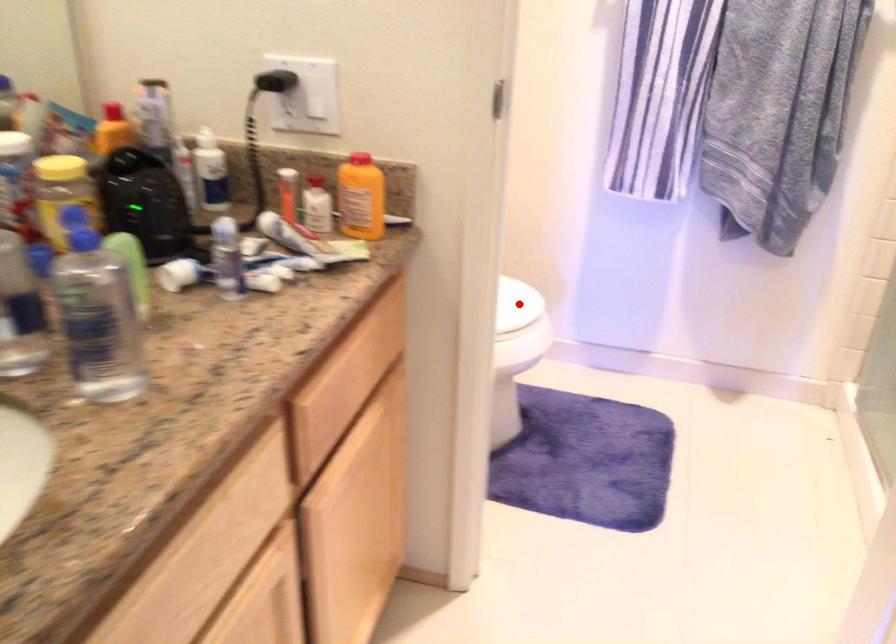
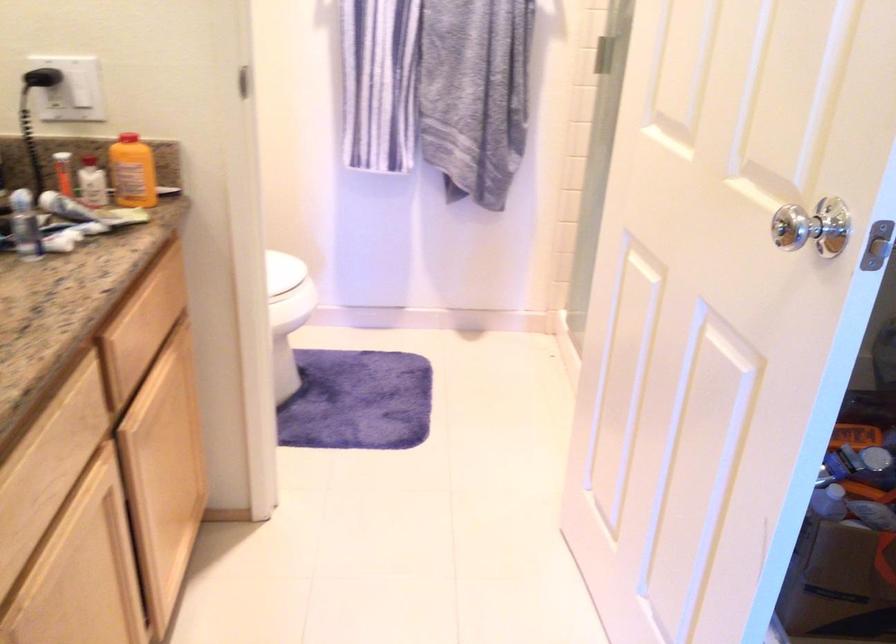
Question: I am providing you with two images of the same scene from different viewpoints. Image1 has a red point marked. In image2, the corresponding 3D location appears at what relative position? Reply with the corresponding letter.

Choices:
 (A) Closer
 (B) Farther

Answer: (B)